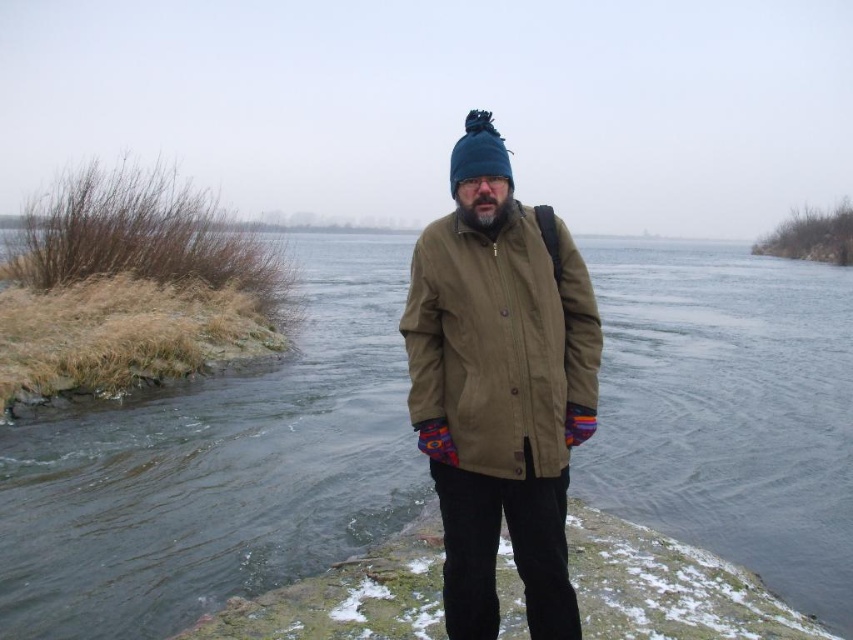
You are a hiker who wants to retrieve your dropped item. The item is located at point (x=500, y=387). You are currently standing at the riverbank. Which direction should you move to reach the item?

The item is located at point (x=500, y=387), which is the olive green fabric coat at center. Since you are at the riverbank, you should move towards the center to reach the item.